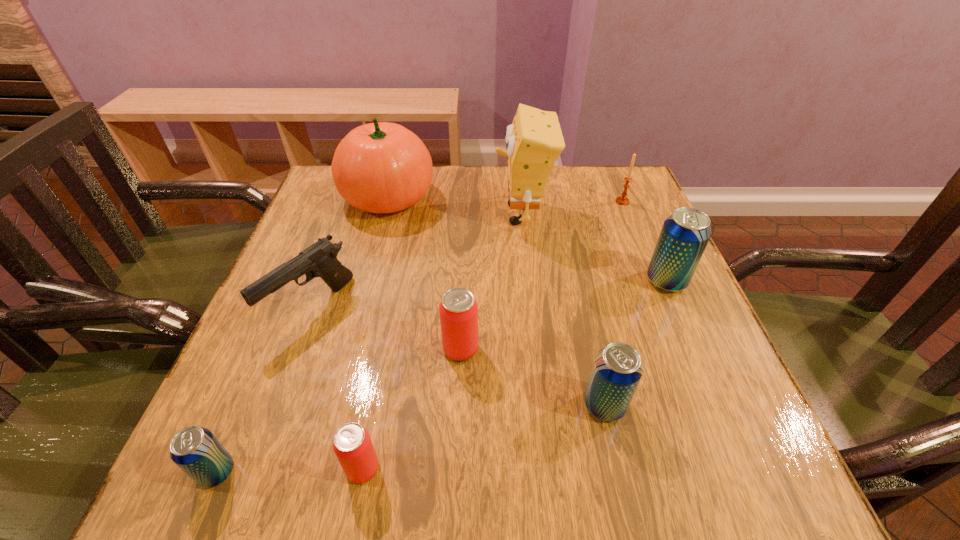
Locate an element on the screen. free space between the second farthest beer can and the black gun is located at coordinates (386, 328).

The width and height of the screenshot is (960, 540). I want to click on free space between the farther red beer can and the nearer red beer can, so click(412, 409).

Image resolution: width=960 pixels, height=540 pixels. Identify the location of object that can be found as the fifth closest to the second nearest blue beer can. (320, 259).

The image size is (960, 540). In order to click on object that is the fourth closest to the yellow sponge in this screenshot , I will do `click(458, 310)`.

At what (x,y) coordinates should I click in order to perform the action: click on the second closest beer can to the leftmost beer can. Please return your answer as a coordinate pair (x, y). Looking at the image, I should click on (458, 310).

Point out which beer can is positioned as the nearest to the smallest blue beer can. Please provide its 2D coordinates. Your answer should be formatted as a tuple, i.e. [(x, y)], where the tuple contains the x and y coordinates of a point satisfying the conditions above.

[(352, 444)]

Identify the location of blue beer can that is the second closest to the pumpkin. This screenshot has height=540, width=960. (617, 369).

Find the location of a particular element. This screenshot has width=960, height=540. the third closest blue beer can to the black gun is located at coordinates (685, 234).

Identify the location of vacant area that satisfies the following two spatial constraints: 1. on the back side of the nearest blue beer can; 2. on the right side of the candle_holder. This screenshot has height=540, width=960. (331, 201).

Where is `free space that satisfies the following two spatial constraints: 1. on the back side of the nearest blue beer can; 2. on the right side of the second blue beer can from left to right`? The image size is (960, 540). free space that satisfies the following two spatial constraints: 1. on the back side of the nearest blue beer can; 2. on the right side of the second blue beer can from left to right is located at coordinates (245, 405).